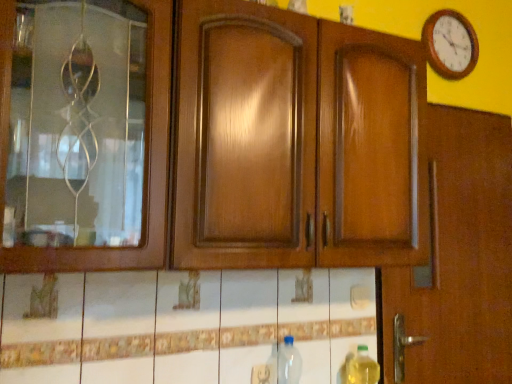
Question: Choose the correct answer: Is wooden clock at upper right inside transparent plastic bottle at lower center, which is counted as the 2th bottle, starting from the right, or outside it?

Choices:
 (A) outside
 (B) inside

Answer: (A)

Question: From a real-world perspective, is wooden clock at upper right above or below transparent plastic bottle at lower center, which is counted as the 2th bottle, starting from the right?

Choices:
 (A) above
 (B) below

Answer: (A)

Question: Based on their relative distances, which object is nearer to the yellow translucent bottle at lower right, which is the second bottle from left to right?

Choices:
 (A) wooden clock at upper right
 (B) transparent plastic bottle at lower center, arranged as the first bottle when viewed from the left

Answer: (B)

Question: Estimate the real-world distances between objects in this image. Which object is closer to the yellow translucent bottle at lower right, arranged as the first bottle when viewed from the right?

Choices:
 (A) wooden clock at upper right
 (B) transparent plastic bottle at lower center, which is counted as the 2th bottle, starting from the right

Answer: (B)